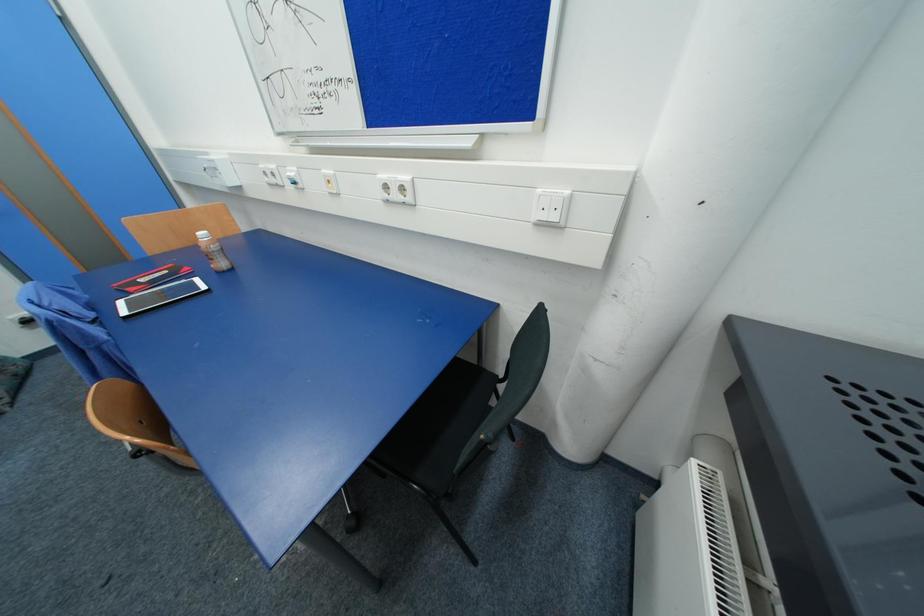
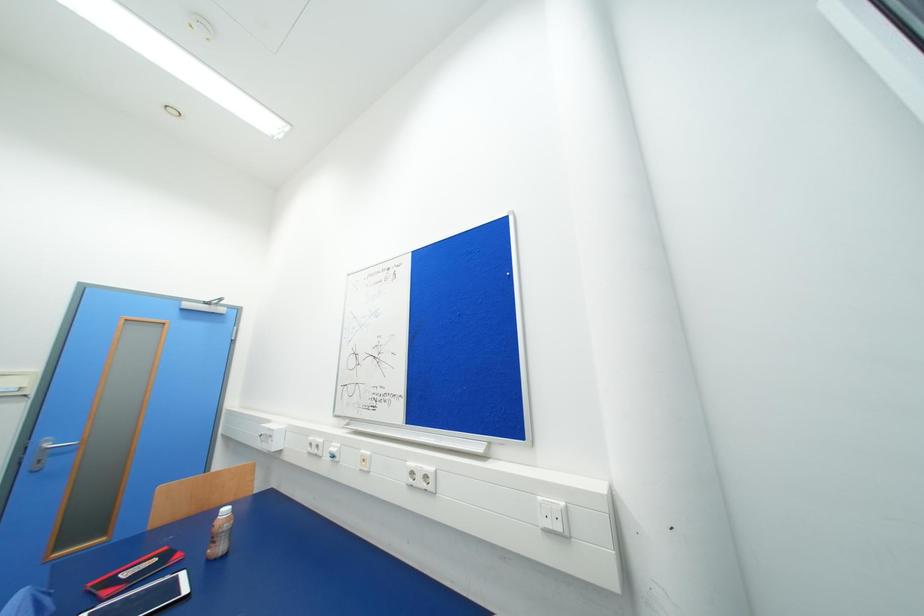
Question: How did the camera likely rotate?

Choices:
 (A) Left
 (B) Right
 (C) Up
 (D) Down

Answer: (C)